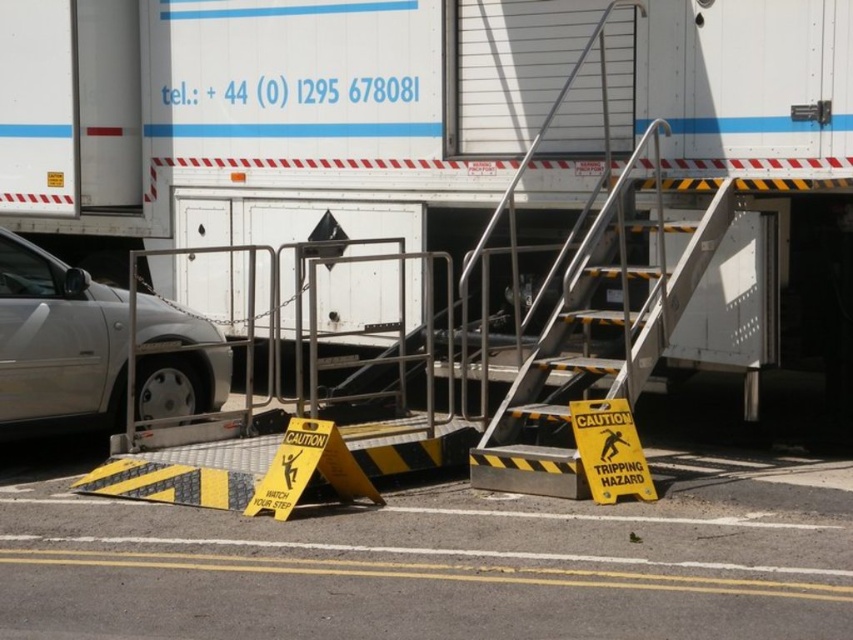
Does white matte truck at center have a smaller size compared to silver metallic car at left?

Indeed, white matte truck at center has a smaller size compared to silver metallic car at left.

Does white matte truck at center have a larger size compared to silver metallic car at left?

No, white matte truck at center is not bigger than silver metallic car at left.

Is point (758, 42) less distant than point (152, 368)?

Yes.

Find the location of a particular element. This screenshot has width=853, height=640. white matte truck at center is located at coordinates (271, 113).

Describe the element at coordinates (271, 113) in the screenshot. I see `white matte truck at center` at that location.

You are a GUI agent. You are given a task and a screenshot of the screen. Output one action in this format:
    pyautogui.click(x=<x>, y=<y>)
    Task: Click on the white matte truck at center
    
    Given the screenshot: What is the action you would take?
    pyautogui.click(x=271, y=113)

Locate an element on the screen. The image size is (853, 640). white matte truck at center is located at coordinates (271, 113).

Which of these two, silver metallic car at left or yellow plastic caution sign at lower center, stands taller?

silver metallic car at left

Who is shorter, silver metallic car at left or yellow plastic caution sign at lower center?

yellow plastic caution sign at lower center

Identify the location of silver metallic car at left. (57, 342).